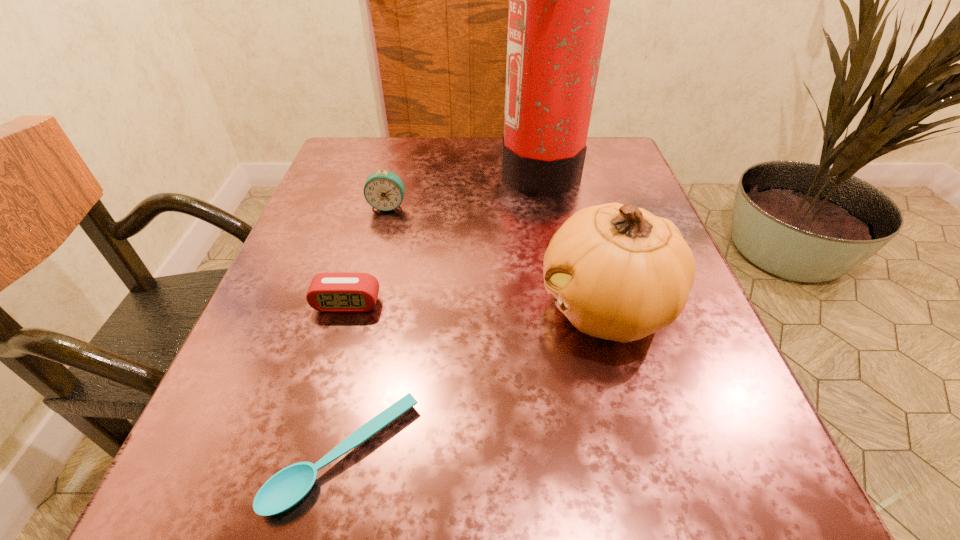
This screenshot has width=960, height=540. What are the coordinates of `fire extinguisher at the right edge` in the screenshot? It's located at (559, 0).

The height and width of the screenshot is (540, 960). In order to click on pumpkin that is positioned at the right edge in this screenshot , I will do (617, 272).

The image size is (960, 540). I want to click on object at the near left corner, so click(286, 488).

Identify the location of object situated at the far right corner. (559, 0).

This screenshot has width=960, height=540. I want to click on blank area at the far edge, so click(422, 180).

Identify the location of free region at the near edge. (370, 524).

Locate an element on the screen. The width and height of the screenshot is (960, 540). vacant space at the left edge of the desktop is located at coordinates (333, 381).

This screenshot has width=960, height=540. I want to click on vacant space at the right edge of the desktop, so click(645, 196).

What are the coordinates of `vacant region at the far left corner of the desktop` in the screenshot? It's located at (347, 185).

Where is `blank space at the near left corner of the desktop`? The width and height of the screenshot is (960, 540). blank space at the near left corner of the desktop is located at coordinates (256, 488).